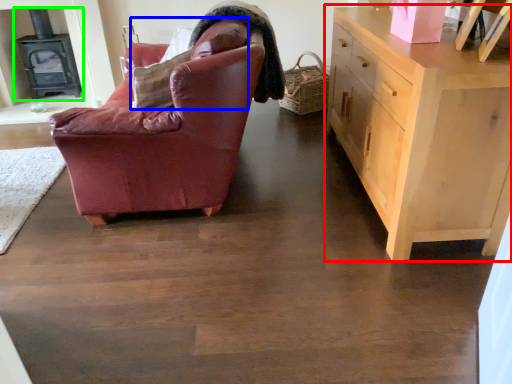
Question: Which object is the closest to the chest of drawers (highlighted by a red box)? Choose among these: pillow (highlighted by a blue box) or fireplace (highlighted by a green box).

Choices:
 (A) pillow
 (B) fireplace

Answer: (A)